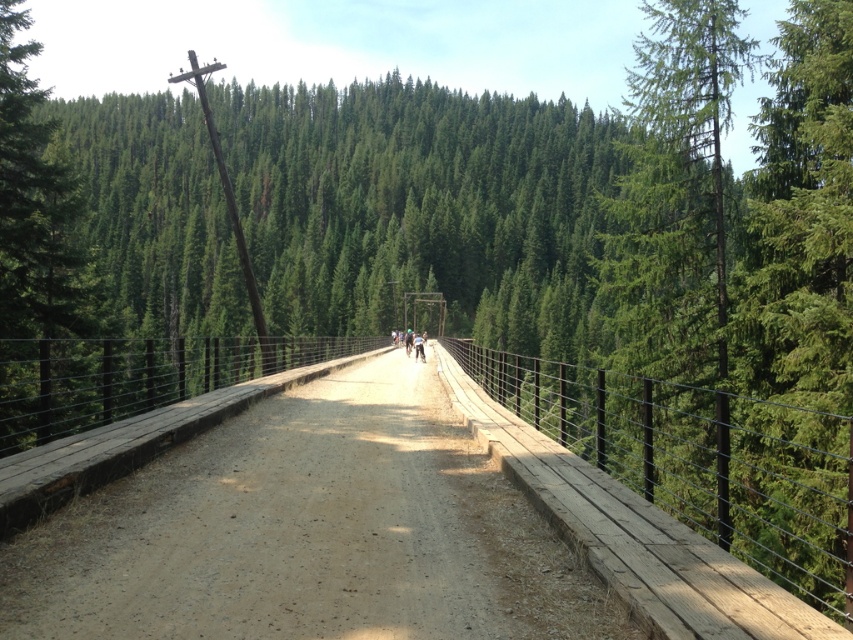
Question: Which point is farther from the camera taking this photo?

Choices:
 (A) (68, 256)
 (B) (421, 340)
 (C) (270, 429)
 (D) (657, 228)

Answer: (B)

Question: Does brown wooden bridge at center have a smaller size compared to green evergreen tree at right?

Choices:
 (A) yes
 (B) no

Answer: (A)

Question: Which of the following is the farthest from the observer?

Choices:
 (A) green evergreen tree at right
 (B) green fabric cyclist at center
 (C) green matte tree at left

Answer: (B)

Question: Is green evergreen tree at right thinner than green matte tree at left?

Choices:
 (A) yes
 (B) no

Answer: (B)

Question: Is brown wooden bridge at center wider than green fabric cyclist at center?

Choices:
 (A) yes
 (B) no

Answer: (A)

Question: Which point is closer to the camera?

Choices:
 (A) coord(666,77)
 (B) coord(28,408)
 (C) coord(521,444)
 (D) coord(413,342)

Answer: (C)